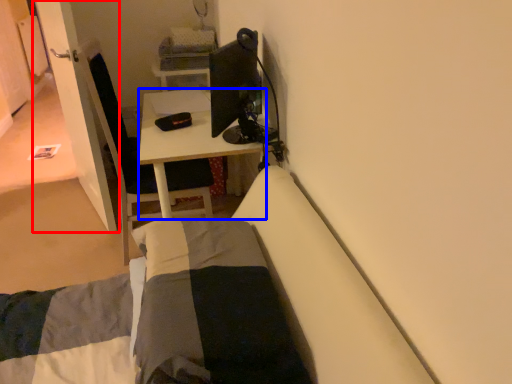
Question: Which point is closer to the camera, door (highlighted by a red box) or desk (highlighted by a blue box)?

Choices:
 (A) door
 (B) desk

Answer: (B)